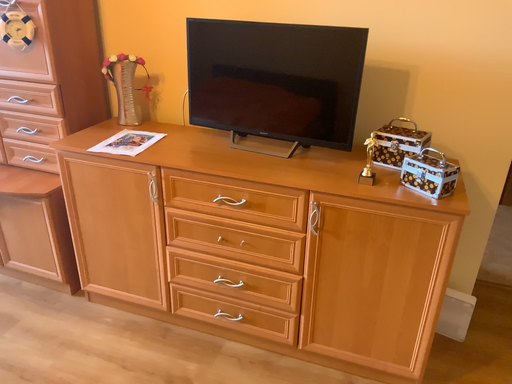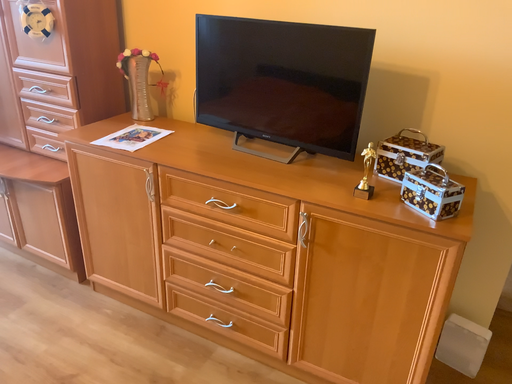
Question: How did the camera likely rotate when shooting the video?

Choices:
 (A) rotated right
 (B) rotated left

Answer: (B)